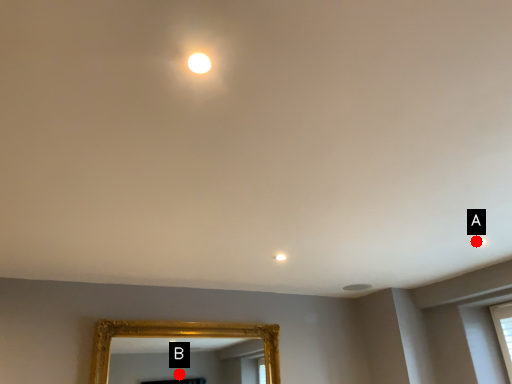
Question: Two points are circled on the image, labeled by A and B beside each circle. Which of the following is the farthest from the observer?

Choices:
 (A) A is further
 (B) B is further

Answer: (B)